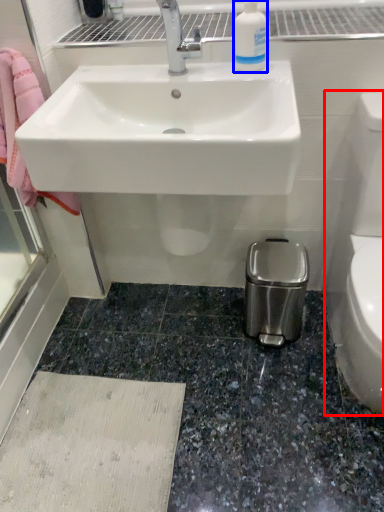
Question: Among these objects, which one is nearest to the camera, toilet bowl (highlighted by a red box) or cleaning product (highlighted by a blue box)?

Choices:
 (A) toilet bowl
 (B) cleaning product

Answer: (A)